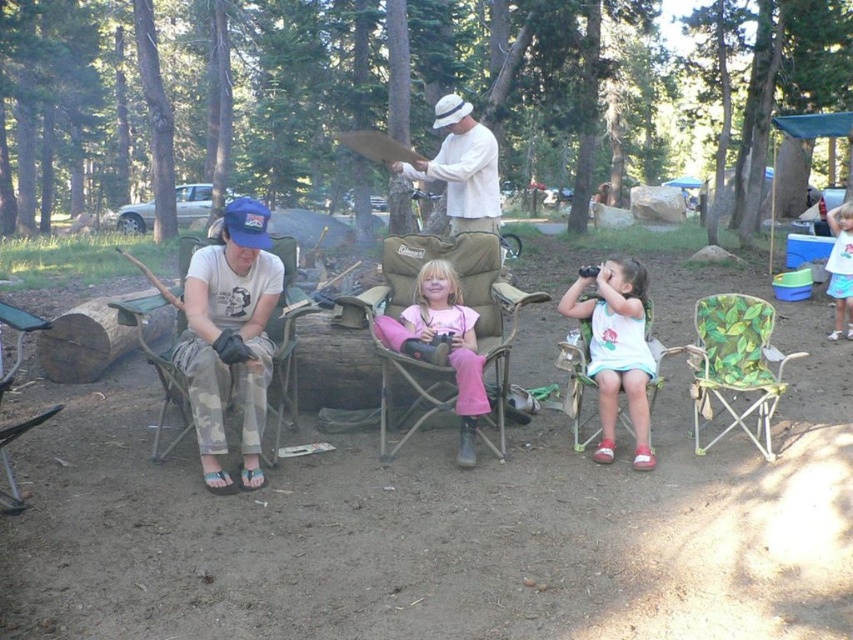
Question: Which of the following is the farthest from the observer?

Choices:
 (A) (828, 288)
 (B) (380, 340)
 (C) (648, 369)
 (D) (254, 308)

Answer: (A)

Question: Estimate the real-world distances between objects in this image. Which object is farther from the white cotton shirt at center?

Choices:
 (A) camouflage fabric chair at left
 (B) camouflage pants at left
 (C) white cotton dress at center

Answer: (A)

Question: Observing the image, what is the correct spatial positioning of camouflage pants at left in reference to white cotton shirt at center?

Choices:
 (A) below
 (B) above

Answer: (A)

Question: Can you confirm if matte brown folding chair at center is thinner than pink fabric pants at center?

Choices:
 (A) yes
 (B) no

Answer: (B)

Question: Estimate the real-world distances between objects in this image. Which object is closer to the white cotton shirt at center?

Choices:
 (A) camouflage fabric chair at left
 (B) green leaf-patterned folding chair at lower right
 (C) camouflage pants at left

Answer: (B)

Question: Does white cotton dress at center appear under pink fabric pants at center?

Choices:
 (A) no
 (B) yes

Answer: (B)